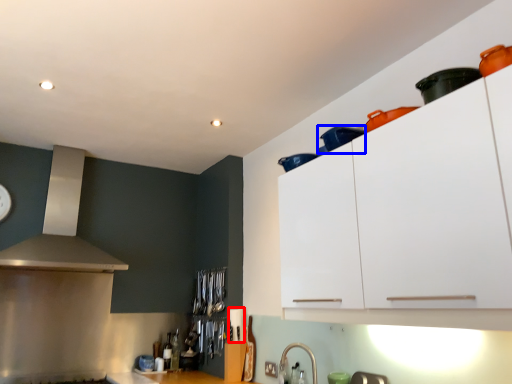
Question: Which object is further to the camera taking this photo, appliance (highlighted by a red box) or appliance (highlighted by a blue box)?

Choices:
 (A) appliance
 (B) appliance

Answer: (A)